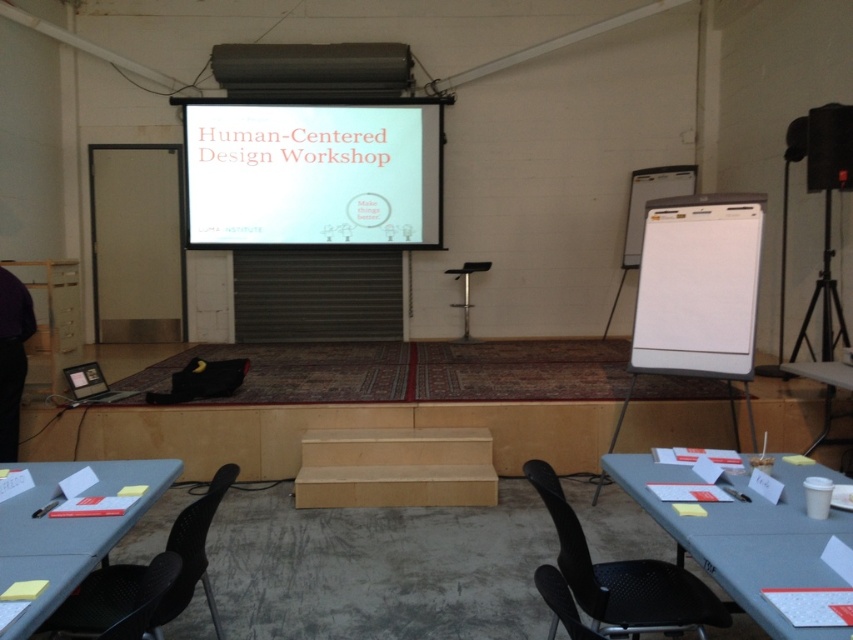
Question: Estimate the real-world distances between objects in this image. Which object is farther from the black plastic chair at lower left?

Choices:
 (A) white matte projection screen at center
 (B) black mesh chair at lower right
 (C) black plastic projector at upper center
 (D) black matte speaker at upper right

Answer: (A)

Question: Which point is closer to the camera?

Choices:
 (A) (822, 403)
 (B) (850, 355)

Answer: (B)

Question: Can you confirm if matte gray table at lower left is smaller than black mesh chair at lower right?

Choices:
 (A) yes
 (B) no

Answer: (A)

Question: Considering the relative positions of black matte speaker at upper right and white plastic table at lower right in the image provided, where is black matte speaker at upper right located with respect to white plastic table at lower right?

Choices:
 (A) above
 (B) below

Answer: (A)

Question: Considering the relative positions of black plastic chair at lower left and black plastic chair at lower center in the image provided, where is black plastic chair at lower left located with respect to black plastic chair at lower center?

Choices:
 (A) right
 (B) left

Answer: (B)

Question: Which of the following is the farthest from the observer?

Choices:
 (A) black plastic chair at lower center
 (B) black plastic projector at upper center
 (C) gray fabric table at lower right

Answer: (B)